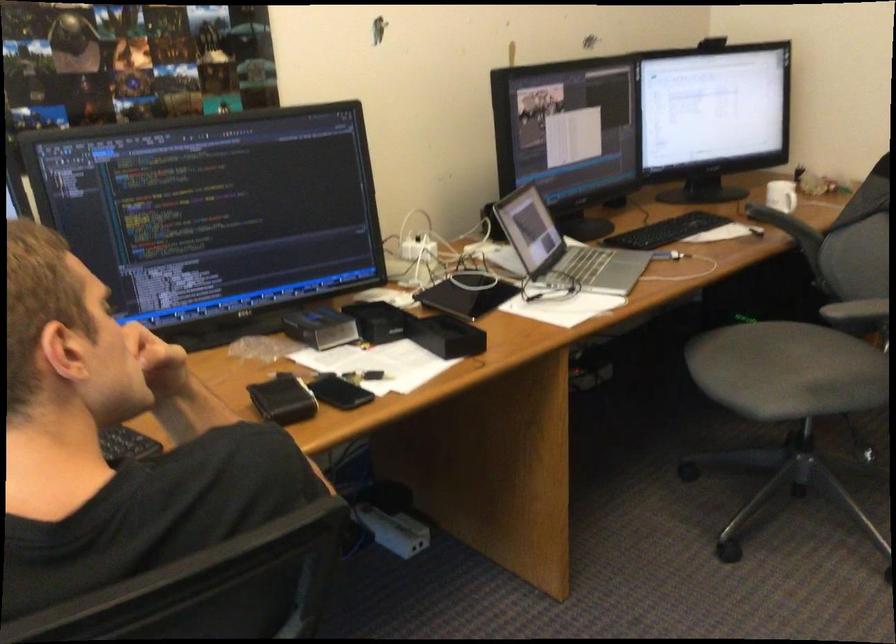
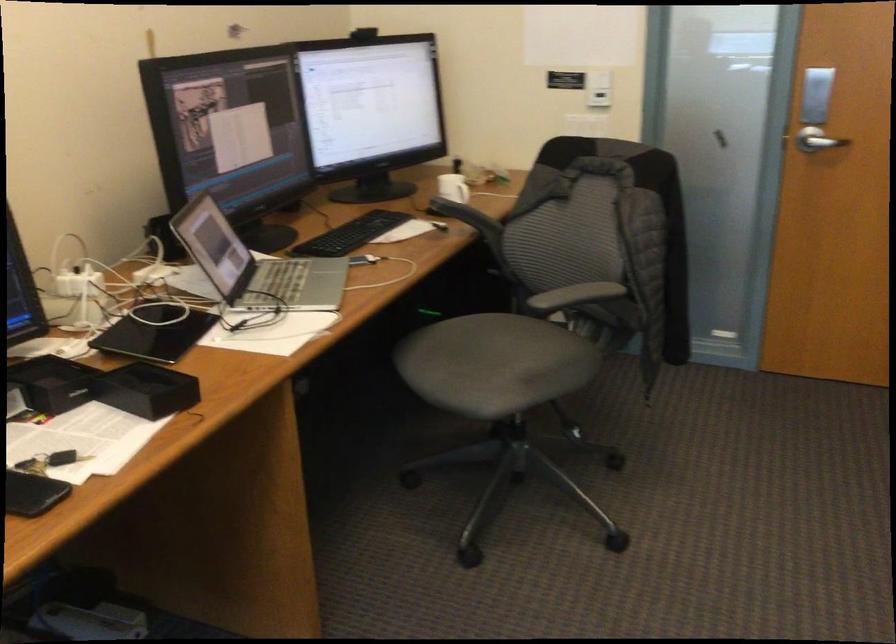
Question: How did the camera likely rotate?

Choices:
 (A) Left
 (B) Right
 (C) Up
 (D) Down

Answer: (B)